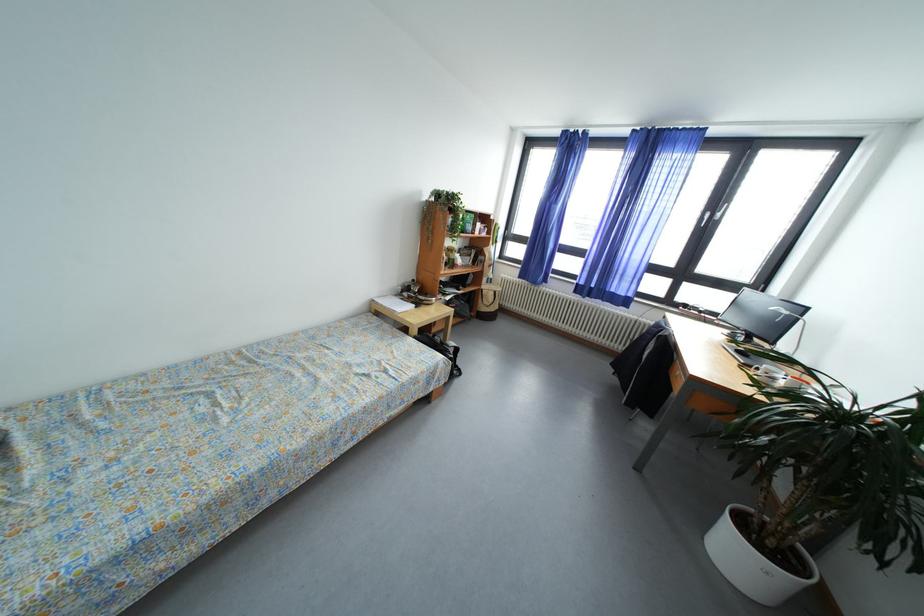
Describe the element at coordinates (714, 214) in the screenshot. The image size is (924, 616). I see `a silver window handle` at that location.